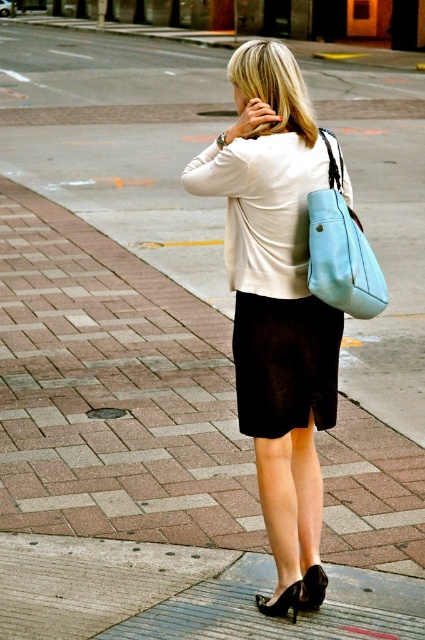
Who is positioned more to the right, matte white blouse at center or light blue leather shoulder bag at right?

Positioned to the right is light blue leather shoulder bag at right.

Which is more to the left, matte white blouse at center or light blue leather shoulder bag at right?

matte white blouse at center

Is point (328, 420) positioned in front of point (322, 296)?

No, (328, 420) is further to viewer.

I want to click on matte white blouse at center, so click(x=277, y=305).